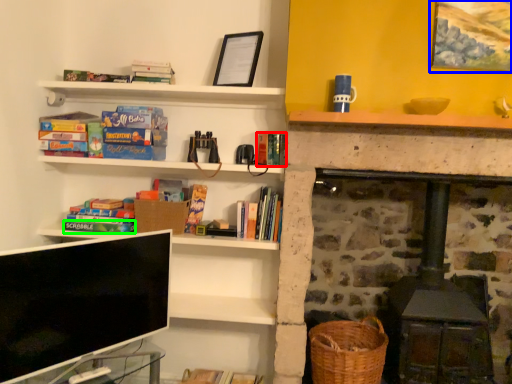
Question: Which is nearer to the book (highlighted by a red box)? picture frame (highlighted by a blue box) or paperback book (highlighted by a green box).

Choices:
 (A) picture frame
 (B) paperback book

Answer: (B)